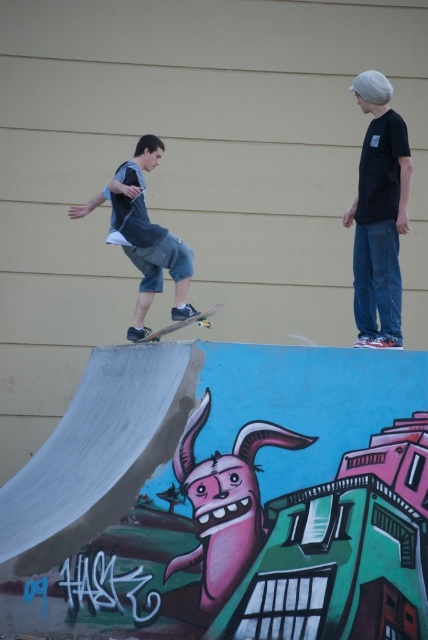
The height and width of the screenshot is (640, 428). Describe the element at coordinates (379, 214) in the screenshot. I see `matte black t-shirt at right` at that location.

Measure the distance from matte black t-shirt at right to wooden skateboard at center.

matte black t-shirt at right and wooden skateboard at center are 1.73 meters apart from each other.

Who is more distant from viewer, (x=372, y=160) or (x=172, y=326)?

Point (x=172, y=326)

I want to click on matte black t-shirt at right, so click(x=379, y=214).

Identify the location of matte black t-shirt at right. The width and height of the screenshot is (428, 640). (379, 214).

Is point (380, 112) positioned behind point (139, 166)?

No, (380, 112) is closer to viewer.

Find the location of a particular element. matte black t-shirt at right is located at coordinates (379, 214).

What do you see at coordinates (143, 236) in the screenshot? I see `matte black skateboard at center` at bounding box center [143, 236].

Who is lower down, matte black skateboard at center or wooden skateboard at center?

Positioned lower is wooden skateboard at center.

The image size is (428, 640). Identify the location of matte black skateboard at center. 143,236.

What are the coordinates of `matte black skateboard at center` in the screenshot? It's located at (143, 236).